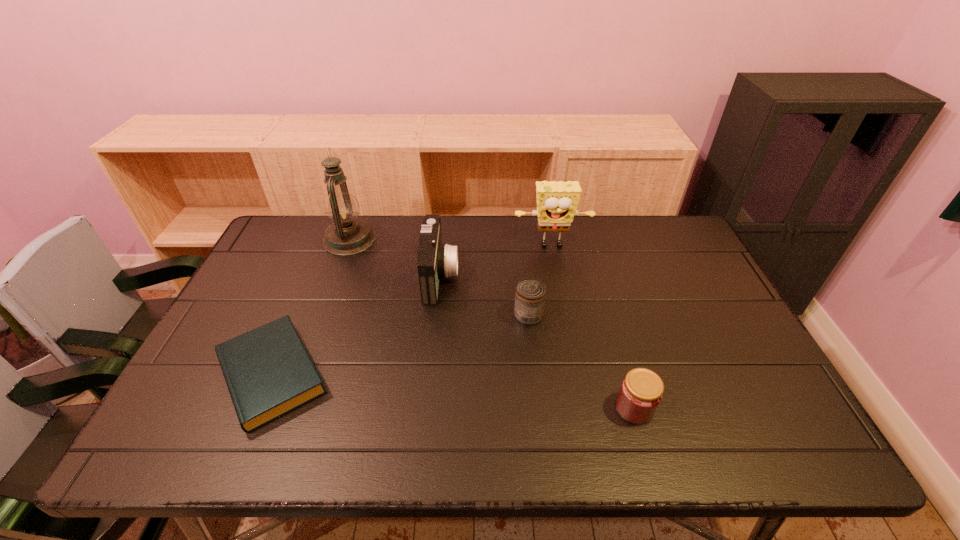
At what (x,y) coordinates should I click in order to perform the action: click on free spot between the book and the tallest object. Please return your answer as a coordinate pair (x, y). Looking at the image, I should click on (311, 307).

Image resolution: width=960 pixels, height=540 pixels. I want to click on free area in between the camcorder and the tallest object, so click(395, 258).

Identify the location of object that can be found as the third closest to the book. This screenshot has width=960, height=540. (530, 295).

The image size is (960, 540). Find the location of `object that can be found as the fourth closest to the book`. object that can be found as the fourth closest to the book is located at coordinates (557, 202).

Locate an element on the screen. vacant space that satisfies the following two spatial constraints: 1. on the front-facing side of the jam; 2. on the right side of the sponge is located at coordinates (584, 408).

Identify the location of free space that satisfies the following two spatial constraints: 1. on the front-facing side of the fifth shortest object; 2. on the lens of the third object from left to right. This screenshot has height=540, width=960. (558, 276).

I want to click on vacant space that satisfies the following two spatial constraints: 1. on the back side of the jam; 2. on the lens of the camcorder, so click(x=596, y=276).

Image resolution: width=960 pixels, height=540 pixels. I want to click on vacant area that satisfies the following two spatial constraints: 1. on the lens of the camcorder; 2. on the right side of the jam, so click(x=426, y=408).

Find the location of a particular element. This screenshot has height=540, width=960. free space that satisfies the following two spatial constraints: 1. on the lens of the third object from left to right; 2. on the left side of the can is located at coordinates pos(436,315).